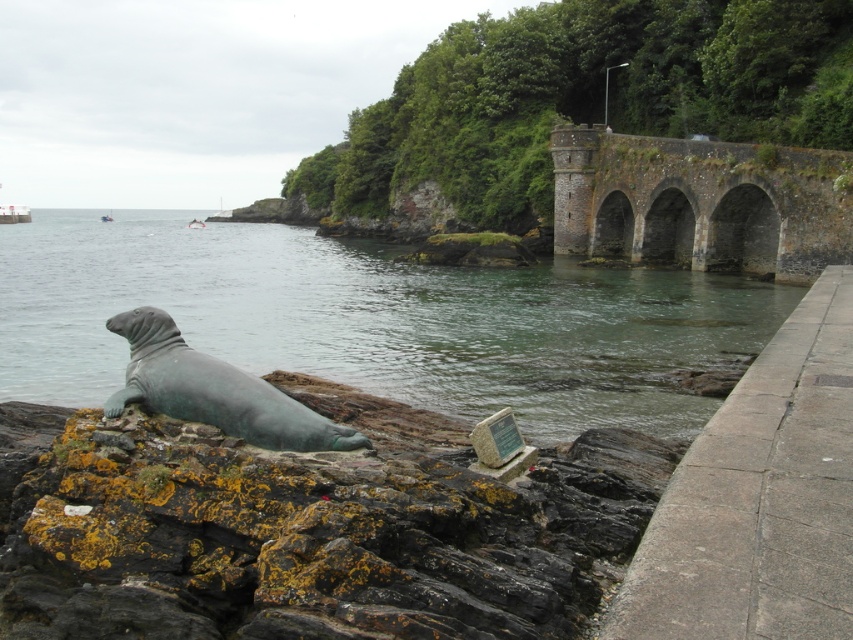
Measure the distance between greenish water at lower left and brown stone bridge at upper right.

A distance of 14.60 meters exists between greenish water at lower left and brown stone bridge at upper right.

Locate an element on the screen. greenish water at lower left is located at coordinates (373, 321).

Does brown stone bridge at upper right have a greater height compared to green patina statue at lower left?

Yes.

Does brown stone bridge at upper right have a larger size compared to green patina statue at lower left?

Correct, brown stone bridge at upper right is larger in size than green patina statue at lower left.

Identify the location of brown stone bridge at upper right. (699, 204).

I want to click on brown stone bridge at upper right, so click(699, 204).

Can you confirm if greenish water at lower left is taller than green patina statue at lower left?

Indeed, greenish water at lower left has a greater height compared to green patina statue at lower left.

Which of these two, greenish water at lower left or green patina statue at lower left, stands taller?

Standing taller between the two is greenish water at lower left.

What do you see at coordinates (373, 321) in the screenshot? The width and height of the screenshot is (853, 640). I see `greenish water at lower left` at bounding box center [373, 321].

Image resolution: width=853 pixels, height=640 pixels. In order to click on greenish water at lower left in this screenshot , I will do [373, 321].